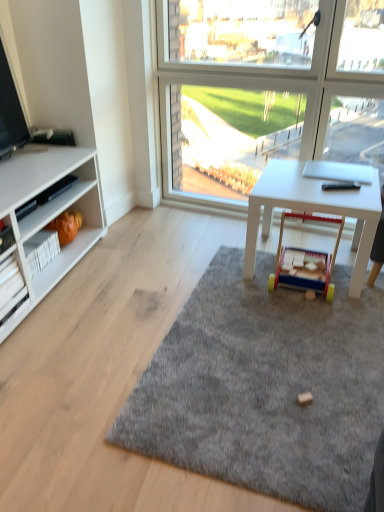
Image resolution: width=384 pixels, height=512 pixels. What do you see at coordinates (66, 226) in the screenshot?
I see `orange fabric toy at lower left, which is the 2th toy from front to back` at bounding box center [66, 226].

Where is `gray soft rug at center`? This screenshot has height=512, width=384. gray soft rug at center is located at coordinates (266, 387).

This screenshot has height=512, width=384. I want to click on white matte desk at center, so click(x=311, y=210).

Between wooden toy at center, which ranks as the first toy in front-to-back order, and white cardboard shelf at left, which one has less height?

white cardboard shelf at left is shorter.

Does wooden toy at center, which is the 2th toy in left-to-right order, appear on the left side of white cardboard shelf at left?

Incorrect, wooden toy at center, which is the 2th toy in left-to-right order, is not on the left side of white cardboard shelf at left.

Considering the sizes of objects wooden toy at center, which ranks as the first toy in front-to-back order, and white cardboard shelf at left in the image provided, who is bigger, wooden toy at center, which ranks as the first toy in front-to-back order, or white cardboard shelf at left?

Bigger between the two is wooden toy at center, which ranks as the first toy in front-to-back order.

Which of these two, wooden toy at center, which is the 2th toy in left-to-right order, or white cardboard shelf at left, is thinner?

Thinner between the two is white cardboard shelf at left.

Which is less distant, (x=74, y=234) or (x=274, y=206)?

Clearly, point (x=74, y=234) is more distant from the camera than point (x=274, y=206).

Which object is thinner, orange fabric toy at lower left, which is the 2th toy from front to back, or white matte desk at center?

orange fabric toy at lower left, which is the 2th toy from front to back, is thinner.

Looking at this image, is orange fabric toy at lower left, the 1th toy when ordered from left to right, aimed at white matte desk at center?

Yes, orange fabric toy at lower left, the 1th toy when ordered from left to right, is oriented towards white matte desk at center.

Is orange fabric toy at lower left, which is the 2th toy from front to back, bigger or smaller than white matte desk at center?

orange fabric toy at lower left, which is the 2th toy from front to back, is smaller than white matte desk at center.

Does point (298, 410) come closer to viewer compared to point (1, 302)?

Yes.

Is gray soft rug at center turned away from white cardboard shelf at left?

gray soft rug at center does not have its back to white cardboard shelf at left.

Where is `mat that appears below the white cardboard shelf at left (from the image's perspective)`? This screenshot has width=384, height=512. mat that appears below the white cardboard shelf at left (from the image's perspective) is located at coordinates (266, 387).

From the image's perspective, which is below, gray soft rug at center or white cardboard shelf at left?

From the image's view, gray soft rug at center is below.

The width and height of the screenshot is (384, 512). Identify the location of shelf that appears in front of the orange fabric toy at lower left, the 1th toy when ordered from left to right. (11, 288).

Is orange fabric toy at lower left, the 1th toy when ordered from left to right, not within white cardboard shelf at left?

That's correct, orange fabric toy at lower left, the 1th toy when ordered from left to right, is outside of white cardboard shelf at left.

Is orange fabric toy at lower left, which is the 2th toy from front to back, oriented towards white cardboard shelf at left?

A: No, orange fabric toy at lower left, which is the 2th toy from front to back, is not aimed at white cardboard shelf at left.

How much distance is there between white matte desk at center and orange fabric toy at lower left, the 1th toy when ordered from left to right?

white matte desk at center is 1.19 meters from orange fabric toy at lower left, the 1th toy when ordered from left to right.

Is point (368, 203) less distant than point (68, 227)?

That is True.

From the picture: Which object is further away from the camera taking this photo, white matte desk at center or orange fabric toy at lower left, which is the 2th toy from front to back?

orange fabric toy at lower left, which is the 2th toy from front to back, is behind.

From a real-world perspective, is white matte desk at center on orange fabric toy at lower left, the 1th toy when ordered from left to right?

Yes.

Identify the location of the 2nd toy above when counting from the gray soft rug at center (from the image's perspective). This screenshot has width=384, height=512. (66, 226).

From the image's perspective, is orange fabric toy at lower left, which is the 2th toy from front to back, below gray soft rug at center?

No, from the image's perspective, orange fabric toy at lower left, which is the 2th toy from front to back, is not beneath gray soft rug at center.

Can you confirm if orange fabric toy at lower left, the 1th toy viewed from the back, is positioned to the right of gray soft rug at center?

No.

Is wooden toy at center, which is the 2th toy in left-to-right order, at the back of white matte desk at center?

That's right, white matte desk at center is facing away from wooden toy at center, which is the 2th toy in left-to-right order.

Does white matte desk at center have a greater width compared to wooden toy at center, which ranks as the first toy in front-to-back order?

Yes, white matte desk at center is wider than wooden toy at center, which ranks as the first toy in front-to-back order.

Which of these two, white matte desk at center or wooden toy at center, which ranks as the first toy in front-to-back order, stands taller?

With more height is white matte desk at center.

This screenshot has width=384, height=512. I want to click on shelf in front of the wooden toy at center, which ranks as the first toy in front-to-back order, so click(x=11, y=288).

Locate an element on the screen. desk positioned vertically above the orange fabric toy at lower left, which is the 2th toy from front to back (from a real-world perspective) is located at coordinates (311, 210).

Looking at the image, which one is located closer to wooden toy at center, which ranks as the first toy in front-to-back order, white matte desk at center or white cardboard shelf at left?

white matte desk at center lies closer to wooden toy at center, which ranks as the first toy in front-to-back order, than the other object.

When comparing their distances from gray soft rug at center, does orange fabric toy at lower left, the 2th toy in the right-to-left sequence, or white matte desk at center seem further?

orange fabric toy at lower left, the 2th toy in the right-to-left sequence, lies further to gray soft rug at center than the other object.

When comparing their distances from orange fabric toy at lower left, the 1th toy when ordered from left to right, does wooden toy at center, which ranks as the first toy in front-to-back order, or gray soft rug at center seem further?

gray soft rug at center is positioned further to the anchor orange fabric toy at lower left, the 1th toy when ordered from left to right.

Based on their spatial positions, is wooden toy at center, the first toy when ordered from right to left, or orange fabric toy at lower left, the 1th toy viewed from the back, closer to white matte desk at center?

wooden toy at center, the first toy when ordered from right to left, is closer to white matte desk at center.

Considering their positions, is white cardboard shelf at left positioned further to wooden toy at center, which ranks as the first toy in front-to-back order, than white matte desk at center?

The object further to wooden toy at center, which ranks as the first toy in front-to-back order, is white cardboard shelf at left.

From the image, which object appears to be farther from gray soft rug at center, white cardboard shelf at left or white matte desk at center?

white cardboard shelf at left.

From the image, which object appears to be nearer to wooden toy at center, which ranks as the first toy in front-to-back order, gray soft rug at center or white matte desk at center?

white matte desk at center lies closer to wooden toy at center, which ranks as the first toy in front-to-back order, than the other object.

Based on their spatial positions, is gray soft rug at center or white cardboard shelf at left further from orange fabric toy at lower left, the 1th toy viewed from the back?

gray soft rug at center lies further to orange fabric toy at lower left, the 1th toy viewed from the back, than the other object.

Identify the location of mat between orange fabric toy at lower left, the 1th toy viewed from the back, and wooden toy at center, the first toy when ordered from right to left. The image size is (384, 512). (266, 387).

Where is `mat situated between white cardboard shelf at left and white matte desk at center from left to right`? The image size is (384, 512). mat situated between white cardboard shelf at left and white matte desk at center from left to right is located at coordinates (266, 387).

Locate an element on the screen. toy between orange fabric toy at lower left, the 2th toy in the right-to-left sequence, and white matte desk at center from left to right is located at coordinates (305, 262).

The height and width of the screenshot is (512, 384). Find the location of `toy between white cardboard shelf at left and gray soft rug at center from left to right`. toy between white cardboard shelf at left and gray soft rug at center from left to right is located at coordinates (66, 226).